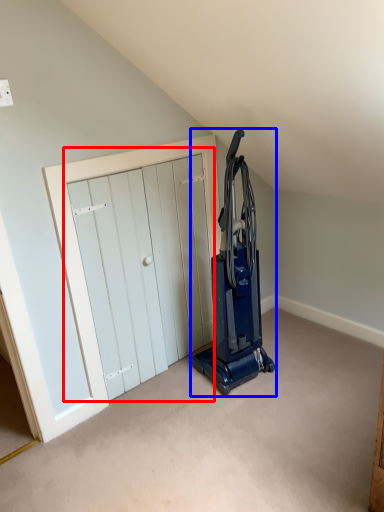
Question: Which object appears closest to the camera in this image, door (highlighted by a red box) or home appliance (highlighted by a blue box)?

Choices:
 (A) door
 (B) home appliance

Answer: (B)